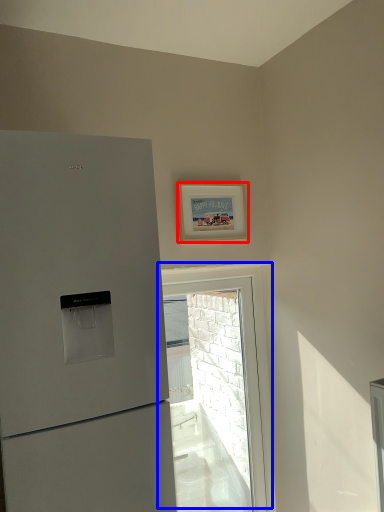
Question: Among these objects, which one is farthest to the camera, picture frame (highlighted by a red box) or window (highlighted by a blue box)?

Choices:
 (A) picture frame
 (B) window

Answer: (B)